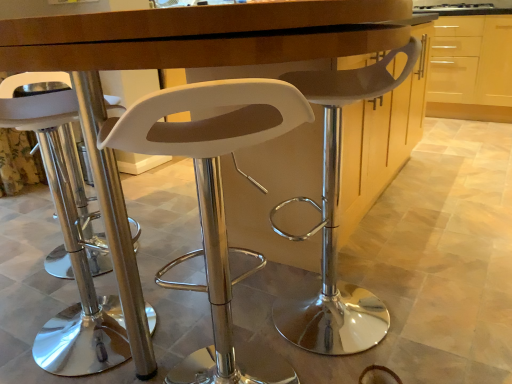
Question: Which direction should I rotate to look at white plastic stool at center, which is counted as the 3th chair, starting from the left?

Choices:
 (A) left
 (B) right

Answer: (B)

Question: Can you confirm if white plastic stool at center, acting as the 2th chair starting from the left, is wider than white plastic stool at left, which is counted as the first chair, starting from the left?

Choices:
 (A) no
 (B) yes

Answer: (A)

Question: Is white plastic stool at left, positioned as the 3th chair in right-to-left order, located within white plastic stool at center, acting as the 2th chair starting from the left?

Choices:
 (A) no
 (B) yes

Answer: (A)

Question: Can you confirm if white plastic stool at center, which ranks as the 2th chair in right-to-left order, is thinner than white plastic stool at left, which is counted as the first chair, starting from the left?

Choices:
 (A) yes
 (B) no

Answer: (A)

Question: From a real-world perspective, is white plastic stool at center, which ranks as the 2th chair in right-to-left order, beneath white plastic stool at left, which is counted as the first chair, starting from the left?

Choices:
 (A) no
 (B) yes

Answer: (A)

Question: Is white plastic stool at center, which ranks as the 2th chair in right-to-left order, positioned with its back to white plastic stool at left, positioned as the 3th chair in right-to-left order?

Choices:
 (A) yes
 (B) no

Answer: (B)

Question: From a real-world perspective, is white plastic stool at center, acting as the 2th chair starting from the left, on white plastic stool at left, which is counted as the first chair, starting from the left?

Choices:
 (A) no
 (B) yes

Answer: (B)

Question: From a real-world perspective, is white plastic stool at left, positioned as the 3th chair in right-to-left order, below white plastic stool at center, marked as the 1th chair in a right-to-left arrangement?

Choices:
 (A) yes
 (B) no

Answer: (A)

Question: Is white plastic stool at left, which is counted as the first chair, starting from the left, positioned with its back to white plastic stool at center, which is counted as the 3th chair, starting from the left?

Choices:
 (A) yes
 (B) no

Answer: (B)

Question: Is white plastic stool at left, which is counted as the first chair, starting from the left, positioned beyond the bounds of white plastic stool at center, marked as the 1th chair in a right-to-left arrangement?

Choices:
 (A) no
 (B) yes

Answer: (B)

Question: From a real-world perspective, does white plastic stool at left, which is counted as the first chair, starting from the left, stand above white plastic stool at center, which is counted as the 3th chair, starting from the left?

Choices:
 (A) no
 (B) yes

Answer: (A)

Question: Can you confirm if white plastic stool at left, positioned as the 3th chair in right-to-left order, is positioned to the left of white plastic stool at center, marked as the 1th chair in a right-to-left arrangement?

Choices:
 (A) no
 (B) yes

Answer: (B)

Question: Does white plastic stool at left, positioned as the 3th chair in right-to-left order, have a greater height compared to white plastic stool at center, marked as the 1th chair in a right-to-left arrangement?

Choices:
 (A) yes
 (B) no

Answer: (B)

Question: Is white plastic stool at center, marked as the 1th chair in a right-to-left arrangement, to the left of light wood cabinet at upper right from the viewer's perspective?

Choices:
 (A) yes
 (B) no

Answer: (A)